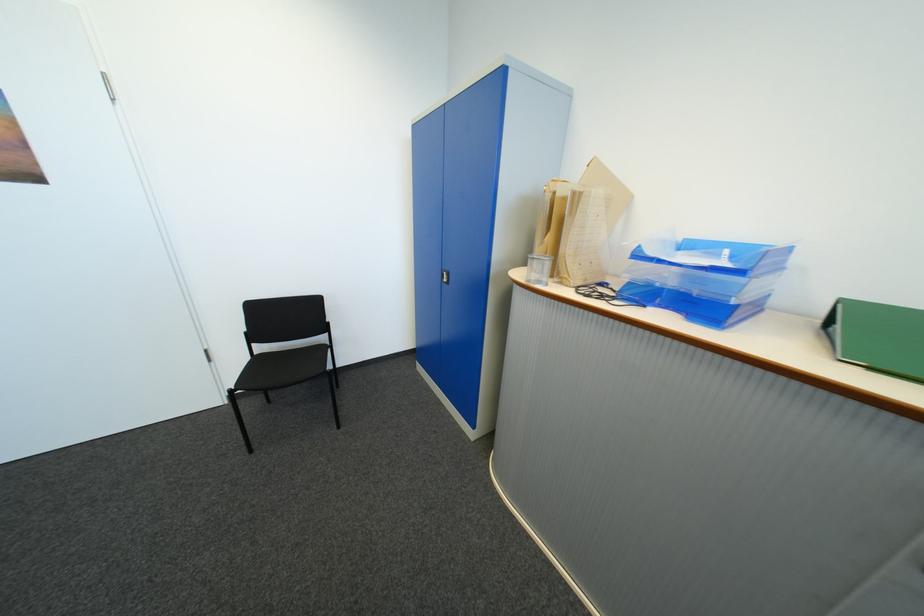
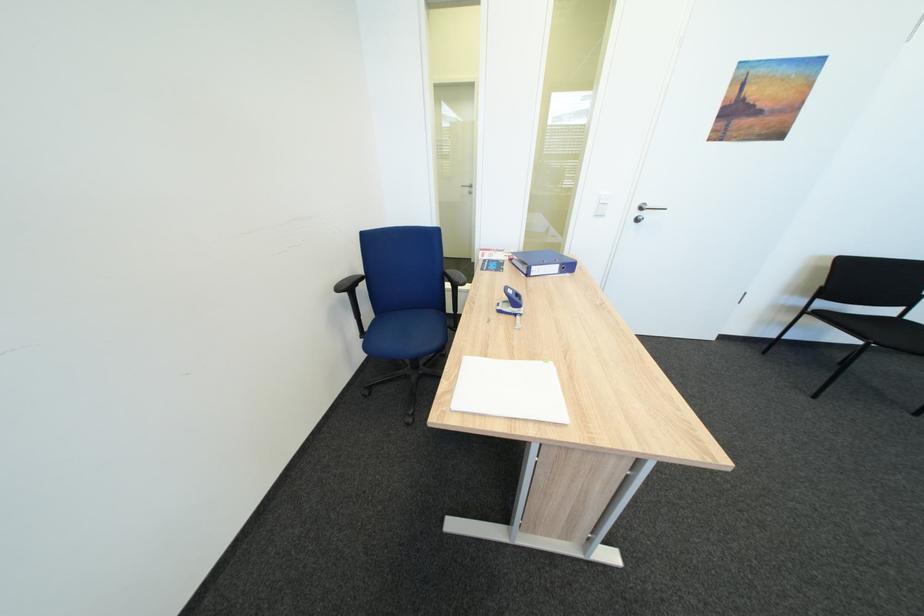
In the second image, find the point that corresponds to [265,355] in the first image.

(819, 310)